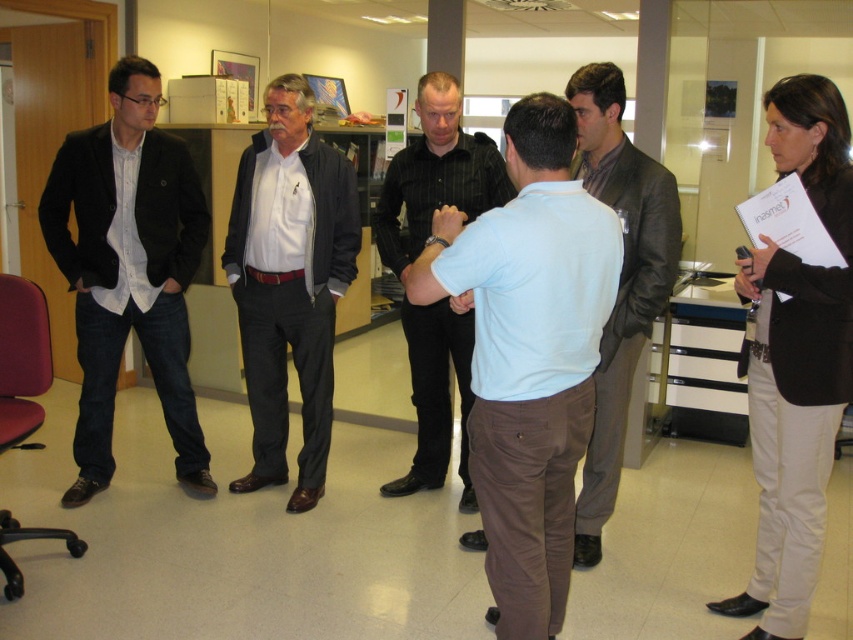
Does white matte shirt at center appear under black striped shirt at center?

Actually, white matte shirt at center is above black striped shirt at center.

Does white matte shirt at center appear on the right side of black striped shirt at center?

No, white matte shirt at center is not to the right of black striped shirt at center.

Describe the element at coordinates (289, 282) in the screenshot. I see `white matte shirt at center` at that location.

Find the location of a particular element. The image size is (853, 640). white matte shirt at center is located at coordinates (289, 282).

Who is positioned more to the right, dark blue denim jeans at left or dark brown leather jacket at center?

Positioned to the right is dark brown leather jacket at center.

Who is positioned more to the left, dark blue denim jeans at left or dark brown leather jacket at center?

dark blue denim jeans at left is more to the left.

You are a GUI agent. You are given a task and a screenshot of the screen. Output one action in this format:
    pyautogui.click(x=<x>, y=<y>)
    Task: Click on the dark blue denim jeans at left
    
    Given the screenshot: What is the action you would take?
    [128, 269]

Is dark blue denim jeans at left to the right of black striped shirt at center from the viewer's perspective?

In fact, dark blue denim jeans at left is to the left of black striped shirt at center.

Between dark blue denim jeans at left and black striped shirt at center, which one has more height?

dark blue denim jeans at left is taller.

Who is more forward, (186, 308) or (451, 83)?

Point (451, 83) is more forward.

Identify the location of dark blue denim jeans at left. This screenshot has height=640, width=853. (128, 269).